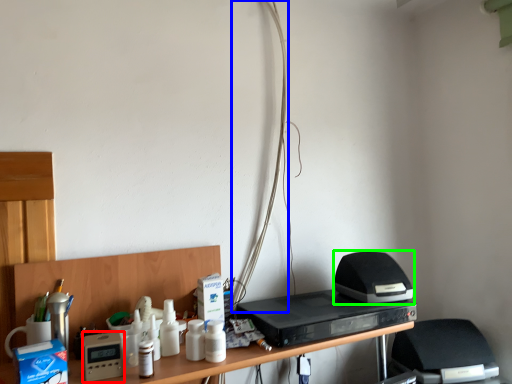
Question: Considering the real-world distances, which object is closest to appliance (highlighted by a red box)? wire (highlighted by a blue box) or appliance (highlighted by a green box).

Choices:
 (A) wire
 (B) appliance

Answer: (A)